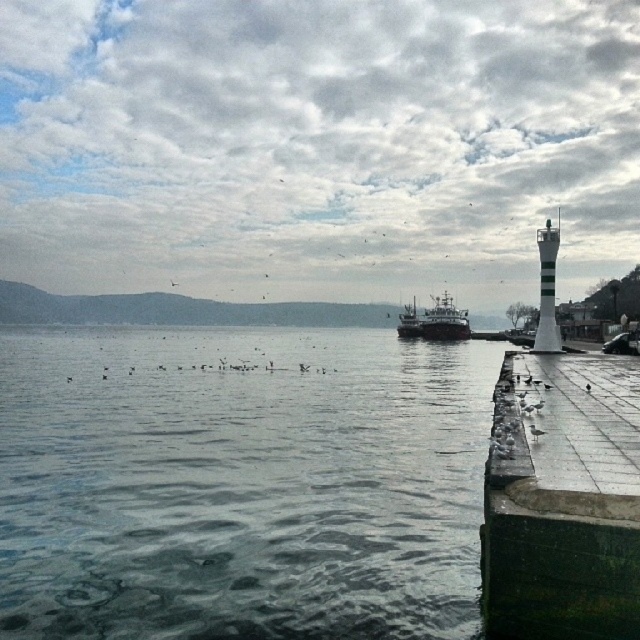
Question: Which of these objects is positioned farthest from the green concrete dock at lower right?

Choices:
 (A) gray matte water at lower left
 (B) dark gray metallic ship at center

Answer: (B)

Question: Does green concrete dock at lower right appear over dark gray metallic ship at center?

Choices:
 (A) no
 (B) yes

Answer: (A)

Question: Does gray matte water at lower left have a greater width compared to dark gray metallic ship at center?

Choices:
 (A) no
 (B) yes

Answer: (B)

Question: Which point is farther from the camera taking this photo?

Choices:
 (A) (563, 625)
 (B) (408, 317)

Answer: (B)

Question: Considering the relative positions of gray matte water at lower left and dark gray metallic ship at center in the image provided, where is gray matte water at lower left located with respect to dark gray metallic ship at center?

Choices:
 (A) below
 (B) above

Answer: (A)

Question: Estimate the real-world distances between objects in this image. Which object is closer to the dark gray metallic ship at center?

Choices:
 (A) green concrete dock at lower right
 (B) gray matte water at lower left

Answer: (B)